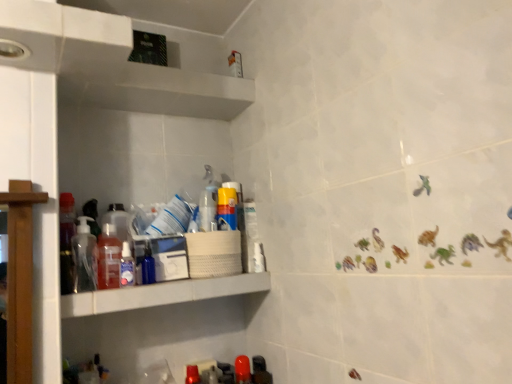
Question: Is translucent plastic bottle at shelf left, the 2th bottle in the left-to-right sequence, spatially inside matte black bottle at lower center, placed as the eighth bottle when sorted from left to right, or outside of it?

Choices:
 (A) outside
 (B) inside

Answer: (A)

Question: Based on their positions, is translucent plastic bottle at shelf left, which ranks as the seventh bottle in right-to-left order, located to the left or right of matte black bottle at lower center, the first bottle when ordered from right to left?

Choices:
 (A) right
 (B) left

Answer: (B)

Question: Which is farther from the translucent plastic soap dispenser at left, the first bottle from the left?

Choices:
 (A) white plastic shelf at center
 (B) translucent plastic bottle at shelf left, acting as the third bottle starting from the left
 (C) glossy plastic bottle at lower center, which is the second bottle in right-to-left order
 (D) translucent plastic bottle at shelf left, which ranks as the seventh bottle in right-to-left order
 (E) transparent plastic spray bottle at center, which is counted as the 3th bottle, starting from the right

Answer: (C)

Question: Based on their relative distances, which object is nearer to the matte black bottle at lower center, placed as the eighth bottle when sorted from left to right?

Choices:
 (A) translucent plastic soap dispenser at left, the eighth bottle from the right
 (B) translucent plastic bottle at shelf left, the 2th bottle in the left-to-right sequence
 (C) matte red plastic bottle at lower center, which appears as the 4th bottle when viewed from the right
 (D) glossy plastic bottle at lower center, which is the second bottle in right-to-left order
 (E) transparent plastic bottle at shelf left, which appears as the fourth bottle when viewed from the left

Answer: (D)